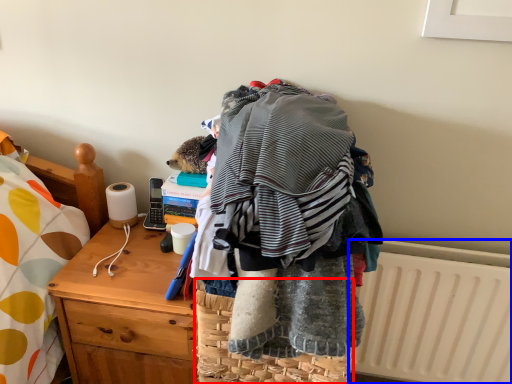
Question: Which of the following is the farthest to the observer, picnic basket (highlighted by a red box) or radiator (highlighted by a blue box)?

Choices:
 (A) picnic basket
 (B) radiator

Answer: (B)